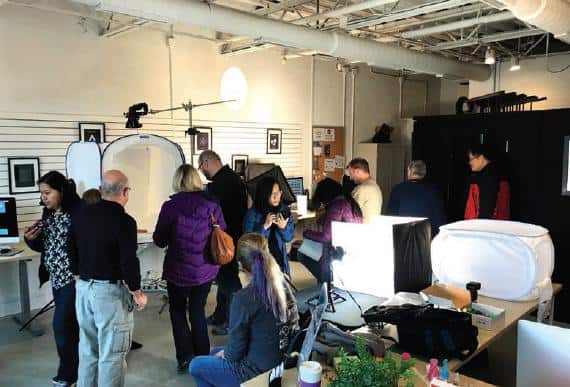
Locate an element on the screen. This screenshot has width=570, height=387. plant is located at coordinates pos(367,371).